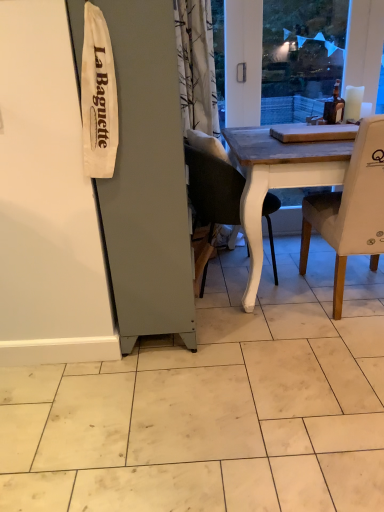
Question: Can you confirm if white fabric chair at right, which ranks as the 2th chair in left-to-right order, is bigger than matte black chair at center, which is the second chair from right to left?

Choices:
 (A) no
 (B) yes

Answer: (B)

Question: Does white fabric chair at right, which ranks as the 2th chair in left-to-right order, have a lesser width compared to matte black chair at center, arranged as the 1th chair when viewed from the left?

Choices:
 (A) yes
 (B) no

Answer: (B)

Question: Would you say matte black chair at center, arranged as the 1th chair when viewed from the left, is part of white fabric chair at right, which ranks as the 2th chair in left-to-right order,'s contents?

Choices:
 (A) no
 (B) yes

Answer: (A)

Question: Considering the relative sizes of white fabric chair at right, which ranks as the 2th chair in left-to-right order, and matte black chair at center, which is the second chair from right to left, in the image provided, is white fabric chair at right, which ranks as the 2th chair in left-to-right order, wider than matte black chair at center, which is the second chair from right to left,?

Choices:
 (A) yes
 (B) no

Answer: (A)

Question: From the image's perspective, would you say white fabric chair at right, which ranks as the 2th chair in left-to-right order, is shown under matte black chair at center, which is the second chair from right to left?

Choices:
 (A) no
 (B) yes

Answer: (B)

Question: Is white fabric chair at right, acting as the first chair starting from the right, to the right of matte black chair at center, arranged as the 1th chair when viewed from the left, from the viewer's perspective?

Choices:
 (A) yes
 (B) no

Answer: (A)

Question: Is matte black chair at center, which is the second chair from right to left, not close to white fabric chair at right, acting as the first chair starting from the right?

Choices:
 (A) no
 (B) yes

Answer: (A)

Question: Could you tell me if matte black chair at center, arranged as the 1th chair when viewed from the left, is facing white fabric chair at right, which ranks as the 2th chair in left-to-right order?

Choices:
 (A) no
 (B) yes

Answer: (B)

Question: Is matte black chair at center, arranged as the 1th chair when viewed from the left, in front of white fabric chair at right, acting as the first chair starting from the right?

Choices:
 (A) no
 (B) yes

Answer: (A)

Question: Is matte black chair at center, arranged as the 1th chair when viewed from the left, further to camera compared to white fabric chair at right, acting as the first chair starting from the right?

Choices:
 (A) no
 (B) yes

Answer: (B)

Question: From the image's perspective, is matte black chair at center, arranged as the 1th chair when viewed from the left, located beneath white fabric chair at right, which ranks as the 2th chair in left-to-right order?

Choices:
 (A) yes
 (B) no

Answer: (B)

Question: Is matte black chair at center, which is the second chair from right to left, at the right side of white fabric chair at right, acting as the first chair starting from the right?

Choices:
 (A) no
 (B) yes

Answer: (A)

Question: Based on their positions, is white fabric chair at right, which ranks as the 2th chair in left-to-right order, located to the left or right of matte black chair at center, which is the second chair from right to left?

Choices:
 (A) right
 (B) left

Answer: (A)